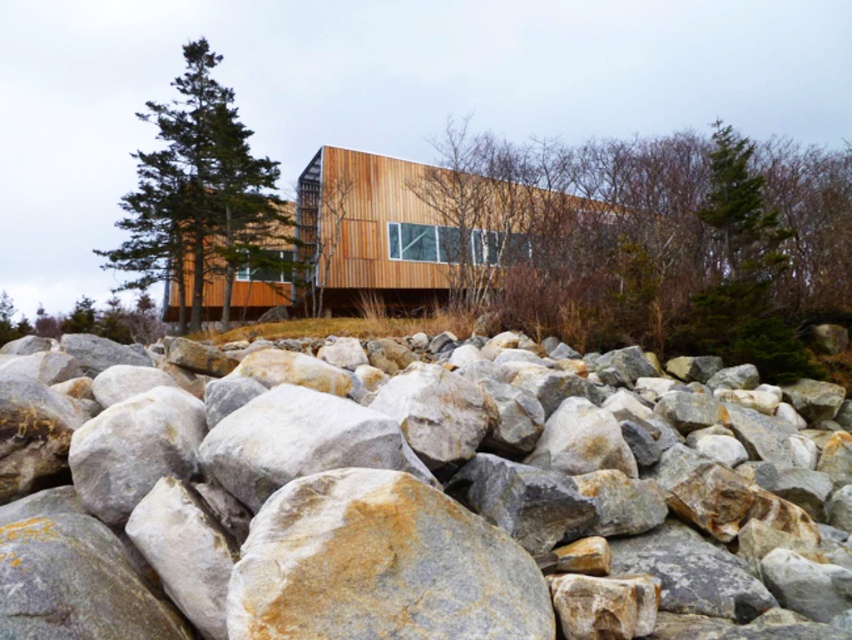
In the scene shown: Is green leafy tree at center in front of gray/textured rock at center?

That is False.

Does green leafy tree at center have a greater height compared to gray/textured rock at center?

Yes.

Find the location of a particular element. green leafy tree at center is located at coordinates (671, 244).

What do you see at coordinates (380, 566) in the screenshot? The image size is (852, 640). I see `gray/textured rock at center` at bounding box center [380, 566].

Between gray/textured rock at center and green matte tree at upper left, which one is positioned higher?

Positioned higher is green matte tree at upper left.

Between point (263, 624) and point (162, 116), which one is positioned behind?

The point (162, 116) is behind.

This screenshot has height=640, width=852. Identify the location of gray/textured rock at center. (380, 566).

Between gray/granite rocks at center and gray/textured rock at center, which one has more height?

gray/textured rock at center is taller.

Is gray/granite rocks at center behind gray/textured rock at center?

Yes, gray/granite rocks at center is behind gray/textured rock at center.

Image resolution: width=852 pixels, height=640 pixels. Describe the element at coordinates (413, 499) in the screenshot. I see `gray/granite rocks at center` at that location.

Find the location of `gray/granite rocks at center`. gray/granite rocks at center is located at coordinates (413, 499).